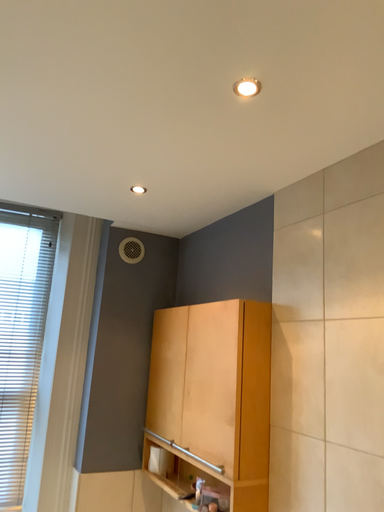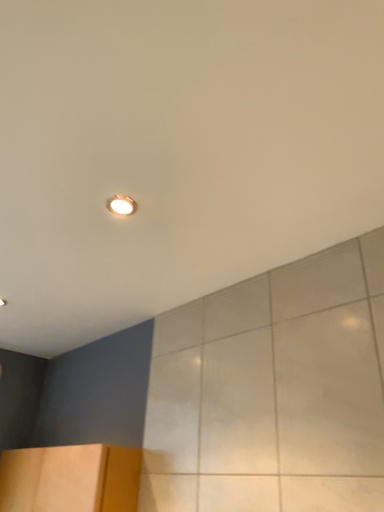
Question: Which way did the camera rotate in the video?

Choices:
 (A) rotated upward
 (B) rotated downward

Answer: (A)